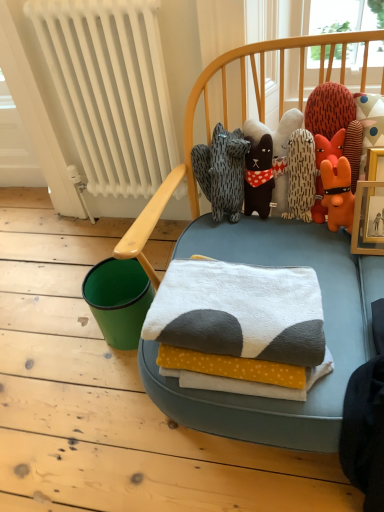
Question: Is white painted metal radiator at left behind soft plush toys at center, the 2th toy when ordered from right to left?

Choices:
 (A) no
 (B) yes

Answer: (B)

Question: From the image's perspective, is white painted metal radiator at left beneath soft plush toys at center, the 2th toy when ordered from right to left?

Choices:
 (A) no
 (B) yes

Answer: (A)

Question: Is white painted metal radiator at left at the left side of soft plush toys at center, the 2th toy when ordered from right to left?

Choices:
 (A) no
 (B) yes

Answer: (B)

Question: Is there a large distance between white painted metal radiator at left and soft plush toys at center, which appears as the first toy when viewed from the left?

Choices:
 (A) yes
 (B) no

Answer: (B)

Question: From the image's perspective, would you say white painted metal radiator at left is positioned over soft plush toys at center, which appears as the first toy when viewed from the left?

Choices:
 (A) yes
 (B) no

Answer: (A)

Question: Is white painted metal radiator at left taller than soft plush toys at center, which appears as the first toy when viewed from the left?

Choices:
 (A) yes
 (B) no

Answer: (A)

Question: Does white soft towel at center appear on the right side of white painted metal radiator at left?

Choices:
 (A) no
 (B) yes

Answer: (B)

Question: Is white soft towel at center wider than white painted metal radiator at left?

Choices:
 (A) yes
 (B) no

Answer: (A)

Question: Is white soft towel at center thinner than white painted metal radiator at left?

Choices:
 (A) yes
 (B) no

Answer: (B)

Question: Would you say white painted metal radiator at left is part of white soft towel at center's contents?

Choices:
 (A) yes
 (B) no

Answer: (B)

Question: Does white soft towel at center have a smaller size compared to white painted metal radiator at left?

Choices:
 (A) yes
 (B) no

Answer: (A)

Question: Would you say white soft towel at center is a long distance from white painted metal radiator at left?

Choices:
 (A) no
 (B) yes

Answer: (A)

Question: Considering the relative sizes of white soft towel at center and orange plush toy at upper right, the second toy when ordered from left to right, in the image provided, is white soft towel at center shorter than orange plush toy at upper right, the second toy when ordered from left to right,?

Choices:
 (A) no
 (B) yes

Answer: (B)